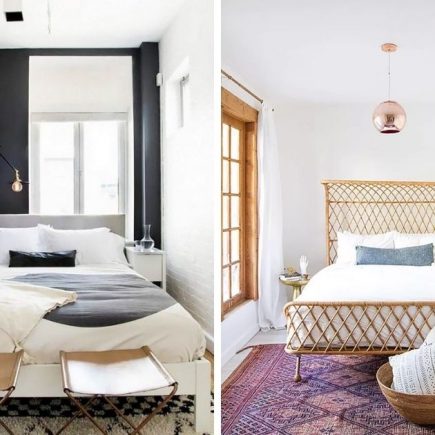
This screenshot has height=435, width=435. Find the location of `purplish rug`. purplish rug is located at coordinates (339, 397).